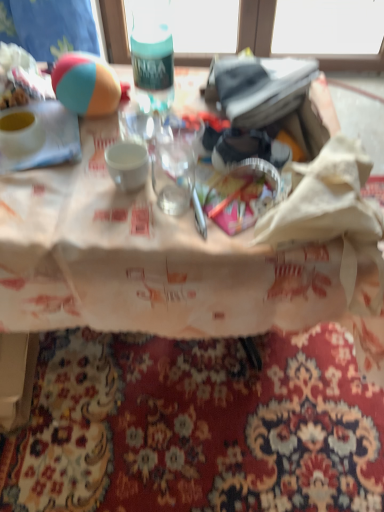
The height and width of the screenshot is (512, 384). I want to click on vacant area that lies to the right of matte white bowl at upper left, so click(x=89, y=136).